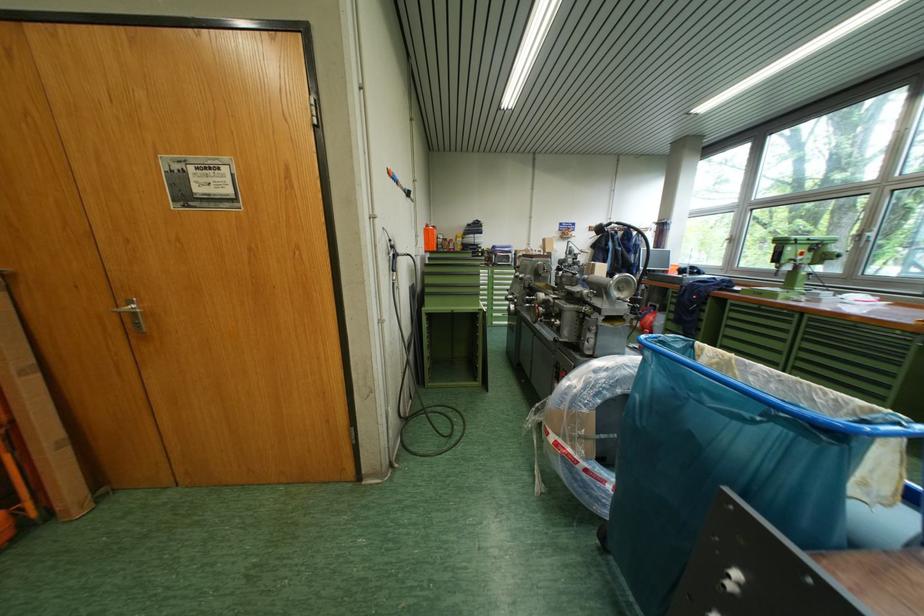
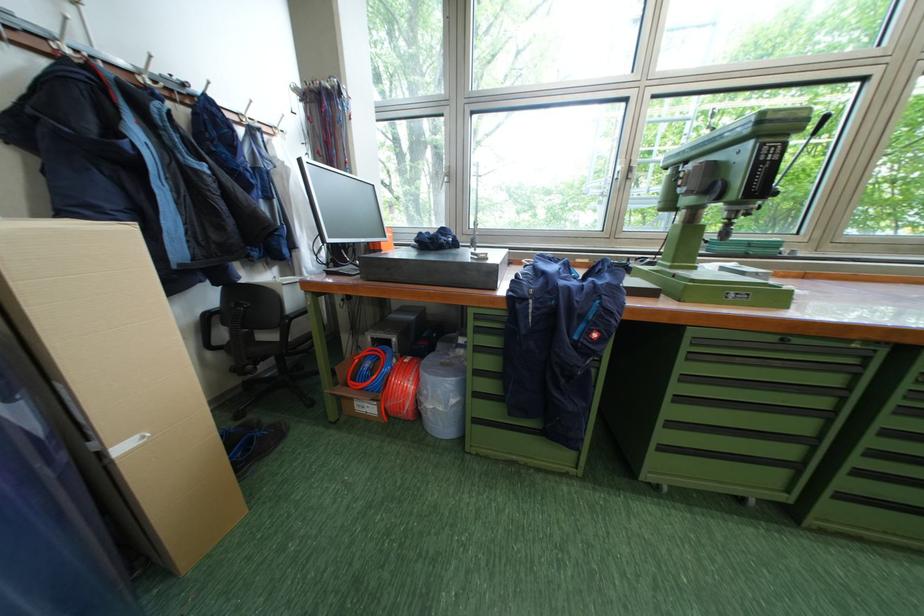
Find the pixel in the second image that matches (x=655, y=317) in the first image.

(396, 383)